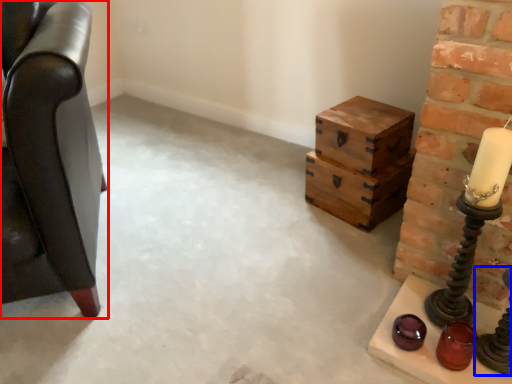
Question: Which object is further to the camera taking this photo, furniture (highlighted by a red box) or candle holder (highlighted by a blue box)?

Choices:
 (A) furniture
 (B) candle holder

Answer: (B)